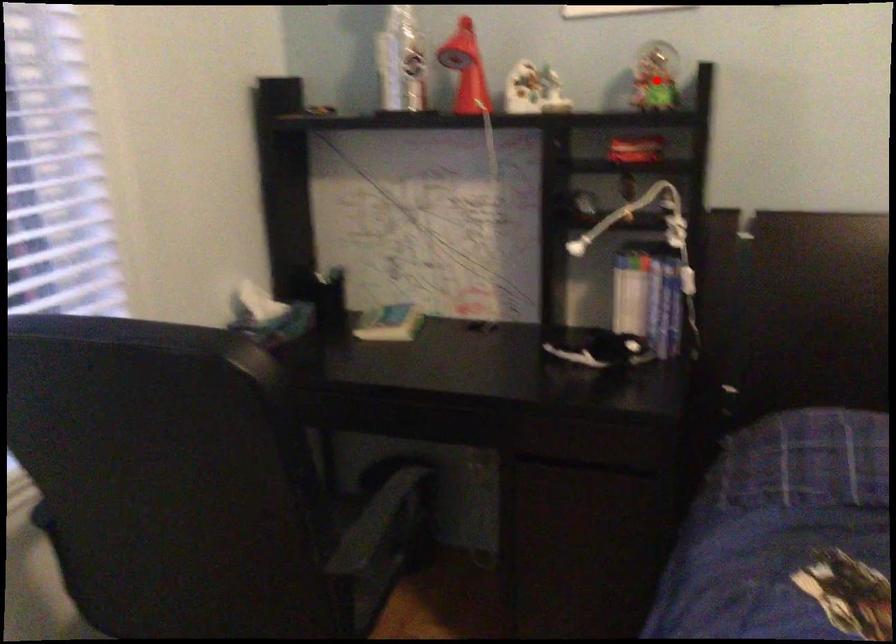
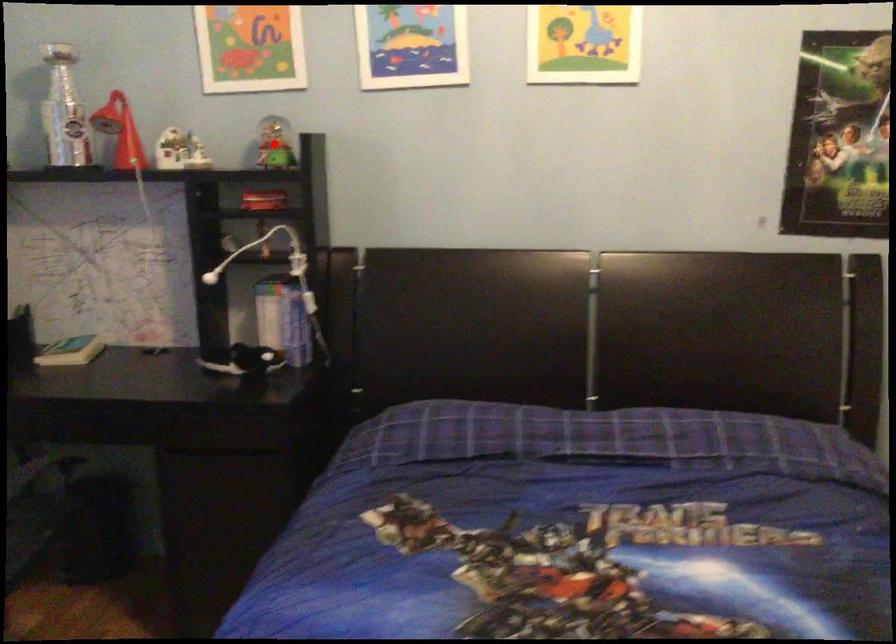
I am providing you with two images of the same scene from different viewpoints. A red point is marked on the first image and another point is marked on the second image. Does the point marked in image1 correspond to the same location as the one in image2?

Yes